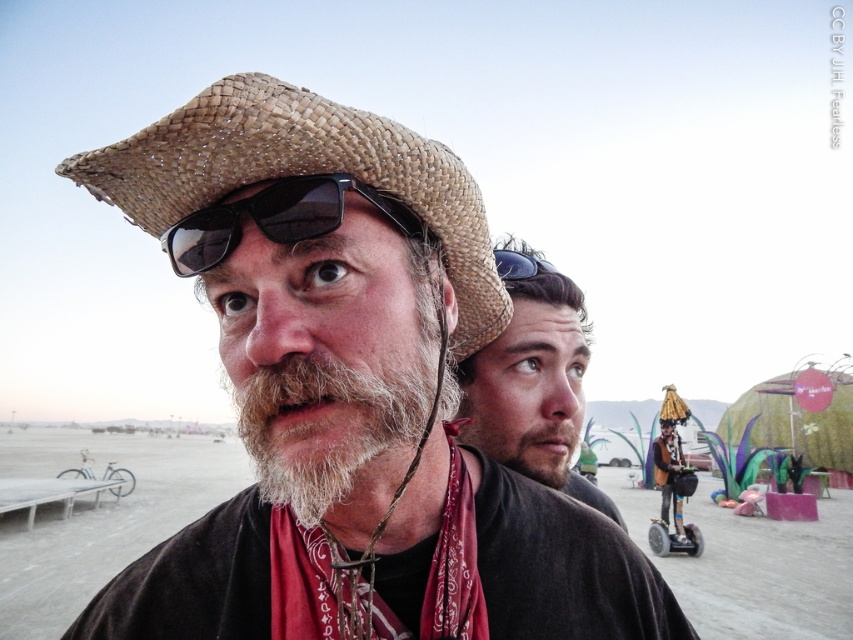
Is point (318, 554) in front of point (531, 266)?

Yes, it is in front of point (531, 266).

Between woven straw hat at center and black matte goggles at upper center, which one appears on the right side from the viewer's perspective?

From the viewer's perspective, black matte goggles at upper center appears more on the right side.

Is point (315, 112) less distant than point (515, 262)?

Yes, point (315, 112) is closer to viewer.

Locate an element on the screen. Image resolution: width=853 pixels, height=640 pixels. woven straw hat at center is located at coordinates (x=347, y=394).

Does graywoollybeard at center have a larger size compared to red bandana at center?

Yes.

Which is in front, point (322, 268) or point (463, 572)?

Point (322, 268)

Image resolution: width=853 pixels, height=640 pixels. What do you see at coordinates (332, 404) in the screenshot?
I see `graywoollybeard at center` at bounding box center [332, 404].

Where is `graywoollybeard at center`? graywoollybeard at center is located at coordinates (332, 404).

Does point (247, 225) lie behind point (585, 481)?

No, it is not.

Based on the photo, which of these two, woven straw hat at center or beige straw hat at center, stands shorter?

woven straw hat at center

Between point (387, 488) and point (579, 368), which one is positioned in front?

Positioned in front is point (387, 488).

In order to click on woven straw hat at center in this screenshot , I will do `click(347, 394)`.